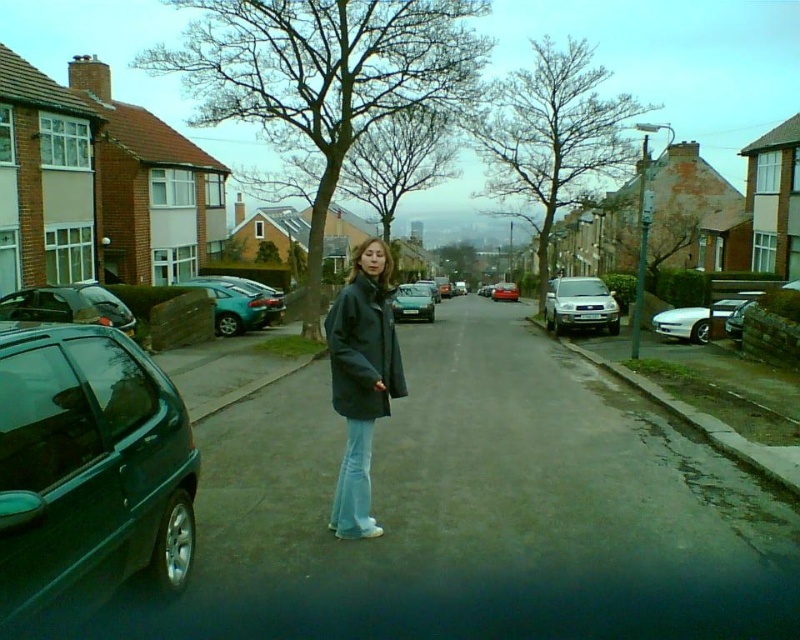
You are a delivery person trying to park your van between the shiny dark green hatchback at lower left and the shiny metallic sedan at center. Can you fit your van there if your van is 2 meters wide?

The shiny dark green hatchback at lower left is thinner than the shiny metallic sedan at center, but the exact width between them isn not provided. Without knowing the distance between the two cars, it is impossible to determine if the van can fit.

You are a delivery driver who needs to park your van between the shiny dark green hatchback at lower left and the metallic blue hatchback at center. Your van is 4.5 meters long. Is there enough space between them to park?

The shiny dark green hatchback at lower left is 5.06 meters away from the metallic blue hatchback at center. Since your van is 4.5 meters long, there is sufficient space between them to park.

You are a delivery person trying to park your van between the shiny black car at left and the metallic blue hatchback at center. The van is 2.2 meters wide. Can you fit the van between them?

The shiny black car at left might be wider than metallic blue hatchback at center, so the distance between them is uncertain. Without knowing the exact width of the cars, it is impossible to determine if the van will fit.